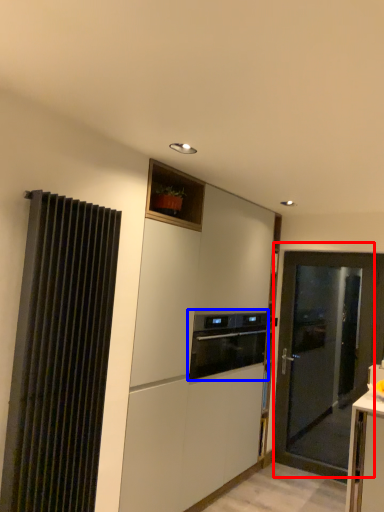
Question: Among these objects, which one is nearest to the camera, door (highlighted by a red box) or home appliance (highlighted by a blue box)?

Choices:
 (A) door
 (B) home appliance

Answer: (B)